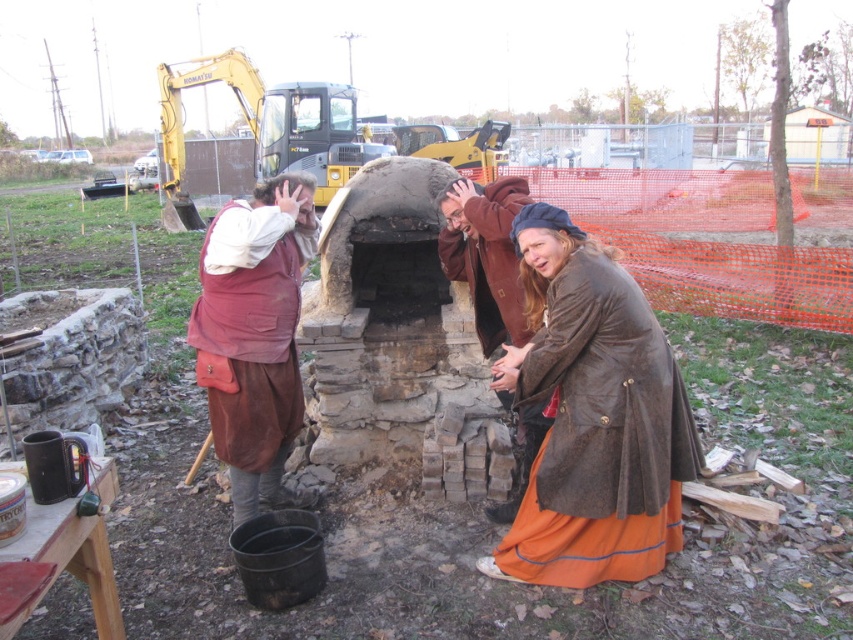
You are an observer standing in front of the brick oven. You see the brown suede coat at lower right and the brown suede vest at center. Which item is closer to the oven?

The brown suede coat at lower right is positioned under brown suede vest at center, so the brown suede coat at lower right is closer to the oven.

You are standing in front of the brick oven and want to hand a tool to both the person wearing the brown suede coat at lower right and the person wearing the brown leather jacket at center. Which person should you hand the tool to first to ensure it reaches them without needing to move around the oven?

You should hand the tool to the brown suede coat at lower right first because it is closer to the viewer than the brown leather jacket at center, making it easier to reach without moving around the oven.

You are an observer standing in front of the brick oven. You notice two people wearing the brown suede vest at center and the brown leather jacket at center. Which clothing item is positioned lower on their body?

The brown suede vest at center is located below the brown leather jacket at center, so the brown suede vest at center is positioned lower on their body.